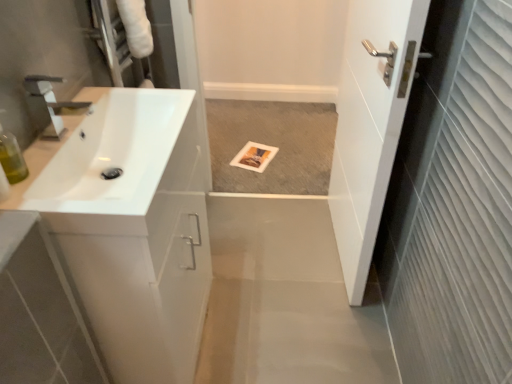
The image size is (512, 384). In order to click on white glossy sink at left in this screenshot , I will do `click(132, 224)`.

What do you see at coordinates (12, 158) in the screenshot? The height and width of the screenshot is (384, 512). I see `translucent green bottle at left` at bounding box center [12, 158].

This screenshot has height=384, width=512. What are the coordinates of `white glossy sink at left` in the screenshot? It's located at (113, 155).

Identify the location of white glossy sink at left. (132, 224).

Does white glossy sink at left have a greater width compared to white glossy door at right?

Correct, the width of white glossy sink at left exceeds that of white glossy door at right.

Considering the relative positions of white glossy sink at left and white glossy door at right in the image provided, is white glossy sink at left to the left of white glossy door at right from the viewer's perspective?

Indeed, white glossy sink at left is positioned on the left side of white glossy door at right.

Looking at this image, who is more distant, white glossy sink at left or white glossy door at right?

white glossy door at right is further away from the camera.

Does point (188, 228) appear closer or farther from the camera than point (374, 34)?

Point (188, 228).

Is translucent green bottle at left turned away from white glossy sink at left?

Absolutely, translucent green bottle at left is directed away from white glossy sink at left.

Is translucent green bottle at left positioned far away from white glossy sink at left?

No, translucent green bottle at left is not far from white glossy sink at left.

From a real-world perspective, who is located higher, translucent green bottle at left or white glossy sink at left?

translucent green bottle at left is physically above.

Would you consider white glossy sink at left to be distant from translucent green bottle at left?

No.

Is translucent green bottle at left completely or partially inside white glossy sink at left?

Definitely not — translucent green bottle at left is not inside white glossy sink at left.

Between white glossy sink at left and translucent green bottle at left, which one has smaller size?

translucent green bottle at left.

From a real-world perspective, does white glossy sink at left sit lower than translucent green bottle at left?

Yes, from a real-world perspective, white glossy sink at left is under translucent green bottle at left.

Does white glossy door at right contain white glossy sink at left?

Actually, white glossy sink at left is outside white glossy door at right.

From a real-world perspective, who is located lower, white glossy door at right or white glossy sink at left?

In real-world perspective, white glossy door at right is lower.

Is white glossy door at right turned away from white glossy sink at left?

white glossy door at right does not have its back to white glossy sink at left.

Is white glossy door at right beside white glossy sink at left?

No, white glossy door at right is not with white glossy sink at left.

From the image's perspective, which is above, translucent green bottle at left or white glossy door at right?

white glossy door at right appears higher in the image.

Which object is more forward, translucent green bottle at left or white glossy door at right?

translucent green bottle at left.

In the image, is translucent green bottle at left on the left side or the right side of white glossy door at right?

From the image, it's evident that translucent green bottle at left is to the left of white glossy door at right.

You are a GUI agent. You are given a task and a screenshot of the screen. Output one action in this format:
    pyautogui.click(x=<x>, y=<y>)
    Task: Click on the sink below the translucent green bottle at left (from a real-world perspective)
    
    Given the screenshot: What is the action you would take?
    pyautogui.click(x=113, y=155)

From a real-world perspective, between white glossy sink at left and translucent green bottle at left, who is vertically lower?

From a 3D spatial view, white glossy sink at left is below.

Who is more distant, white glossy sink at left or translucent green bottle at left?

translucent green bottle at left is behind.

Identify the location of door above the white glossy sink at left (from a real-world perspective). Image resolution: width=512 pixels, height=384 pixels. (370, 124).

In terms of size, does white glossy door at right appear bigger or smaller than white glossy sink at left?

white glossy door at right is smaller than white glossy sink at left.

Is point (378, 221) positioned in front of point (113, 92)?

No.

The width and height of the screenshot is (512, 384). What are the coordinates of `counter top in front of the white glossy door at right` in the screenshot? It's located at (132, 224).

Where is `toiletry below the white glossy sink at left (from the image's perspective)`? Image resolution: width=512 pixels, height=384 pixels. toiletry below the white glossy sink at left (from the image's perspective) is located at coordinates [x=12, y=158].

Considering their positions, is white glossy sink at left positioned closer to white glossy door at right than white glossy sink at left?

white glossy sink at left.

From the picture: Estimate the real-world distances between objects in this image. Which object is further from translucent green bottle at left, white glossy sink at left or white glossy door at right?

Based on the image, white glossy door at right appears to be further to translucent green bottle at left.

Consider the image. From the image, which object appears to be farther from translucent green bottle at left, white glossy door at right or white glossy sink at left?

white glossy door at right lies further to translucent green bottle at left than the other object.

Which object lies further to the anchor point white glossy sink at left, white glossy door at right or translucent green bottle at left?

white glossy door at right lies further to white glossy sink at left than the other object.

Based on their spatial positions, is white glossy door at right or white glossy sink at left closer to translucent green bottle at left?

The object closer to translucent green bottle at left is white glossy sink at left.

Estimate the real-world distances between objects in this image. Which object is closer to white glossy sink at left, translucent green bottle at left or white glossy door at right?

The object closer to white glossy sink at left is translucent green bottle at left.

Looking at the image, which one is located further to white glossy sink at left, white glossy door at right or translucent green bottle at left?

white glossy door at right lies further to white glossy sink at left than the other object.

Consider the image. Considering their positions, is translucent green bottle at left positioned closer to white glossy sink at left than white glossy sink at left?

white glossy sink at left is closer to white glossy sink at left.

At what (x,y) coordinates should I click in order to perform the action: click on toiletry between white glossy sink at left and white glossy sink at left from top to bottom. Please return your answer as a coordinate pair (x, y). Looking at the image, I should click on (12, 158).

The width and height of the screenshot is (512, 384). I want to click on counter top between translucent green bottle at left and white glossy door at right in the horizontal direction, so click(132, 224).

At what (x,y) coordinates should I click in order to perform the action: click on counter top between white glossy sink at left and white glossy door at right. Please return your answer as a coordinate pair (x, y). This screenshot has height=384, width=512. Looking at the image, I should click on (132, 224).

You are a GUI agent. You are given a task and a screenshot of the screen. Output one action in this format:
    pyautogui.click(x=<x>, y=<y>)
    Task: Click on the sink between translucent green bottle at left and white glossy door at right in the horizontal direction
    
    Given the screenshot: What is the action you would take?
    pyautogui.click(x=113, y=155)